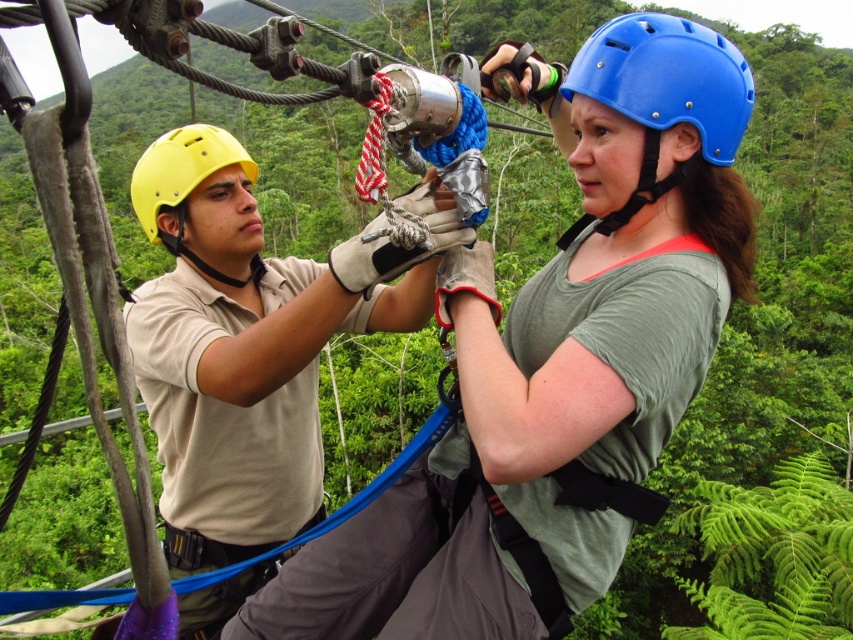
You are a safety inspector checking the helmets of two zipline participants. The blue hard plastic helmet at center is worn by the person being assisted, while the yellow matte helmet at upper left is worn by the assistant. According to safety regulations, helmets must be at least 3 cm thick. Can you determine if both helmets meet the minimum thickness requirement based on their descriptions?

The blue hard plastic helmet at center is thinner than the yellow matte helmet at upper left. However, since the exact thickness of either helmet isn not provided, we cannot definitively determine if both meet the 3 cm minimum requirement. Additional measurements are needed.

You are standing at the starting point of a zipline and see the matte khaki shirt at center. If the safety guidelines require you to be at least 5 feet away from any other participant before launching, is it safe to proceed?

The matte khaki shirt at center is 6.30 feet away from the viewer, which exceeds the 5 feet safety requirement. Therefore, it is safe to proceed with the launch.

Based on the coordinates provided, can you identify which object corresponds to the point labeled as point (242, 348)?

The point (242, 348) corresponds to the matte khaki shirt at center.